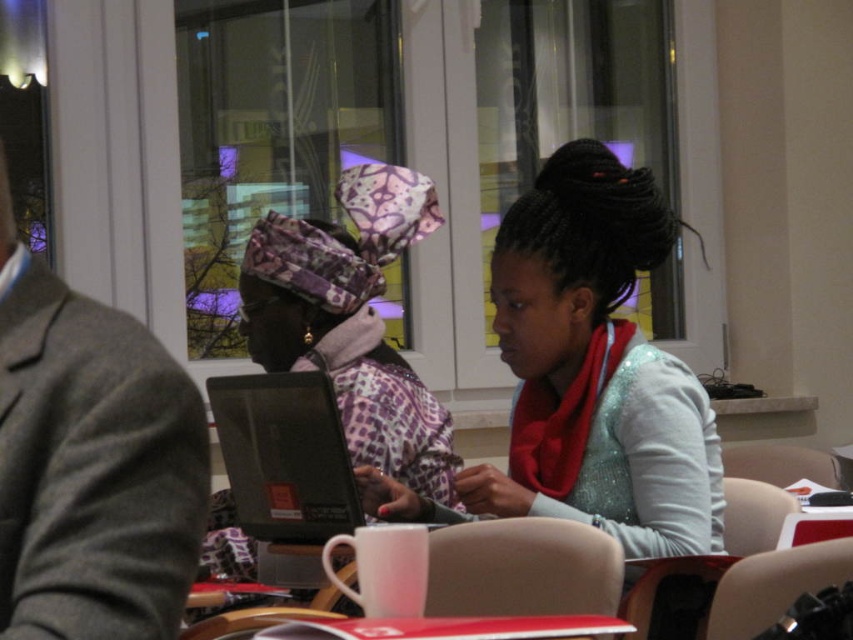
Based on the scene description, where is the satin silver scarf at center located in terms of coordinates?

The satin silver scarf at center is located at point coordinates of (595, 369).

You are a photographer in the conference room. You want to take a photo of the satin silver scarf at center and the black glossy laptop at center. Which object will appear larger in the photo?

The satin silver scarf at center will appear larger in the photo because it is much taller than the black glossy laptop at center.